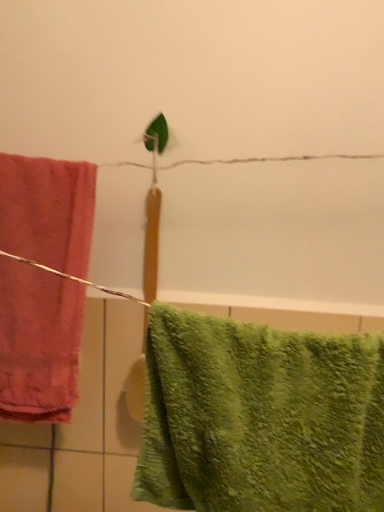
Question: Is green fuzzy towel at lower right, marked as the 2th towel in a left-to-right arrangement, further to the viewer compared to matte pink towel at left, arranged as the 2th towel when viewed from the right?

Choices:
 (A) no
 (B) yes

Answer: (A)

Question: Considering the relative sizes of green fuzzy towel at lower right, arranged as the first towel when viewed from the right, and matte pink towel at left, which is counted as the 2th towel, starting from the front, in the image provided, is green fuzzy towel at lower right, arranged as the first towel when viewed from the right, taller than matte pink towel at left, which is counted as the 2th towel, starting from the front,?

Choices:
 (A) yes
 (B) no

Answer: (B)

Question: Does green fuzzy towel at lower right, which ranks as the first towel in front-to-back order, have a lesser width compared to matte pink towel at left, arranged as the 2th towel when viewed from the right?

Choices:
 (A) yes
 (B) no

Answer: (B)

Question: Is green fuzzy towel at lower right, which ranks as the first towel in front-to-back order, closer to camera compared to matte pink towel at left, marked as the 1th towel in a left-to-right arrangement?

Choices:
 (A) yes
 (B) no

Answer: (A)

Question: Are green fuzzy towel at lower right, which ranks as the first towel in front-to-back order, and matte pink towel at left, which is counted as the 2th towel, starting from the front, located far from each other?

Choices:
 (A) yes
 (B) no

Answer: (B)

Question: Does green fuzzy towel at lower right, marked as the 2th towel in a left-to-right arrangement, have a greater width compared to matte pink towel at left, the 1th towel in the back-to-front sequence?

Choices:
 (A) yes
 (B) no

Answer: (A)

Question: From a real-world perspective, is matte pink towel at left, the 1th towel in the back-to-front sequence, on top of green fuzzy towel at lower right, arranged as the first towel when viewed from the right?

Choices:
 (A) yes
 (B) no

Answer: (A)

Question: Does matte pink towel at left, which is counted as the 2th towel, starting from the front, have a larger size compared to green fuzzy towel at lower right, placed as the 2th towel when sorted from back to front?

Choices:
 (A) yes
 (B) no

Answer: (B)

Question: Considering the relative positions of matte pink towel at left, which is counted as the 2th towel, starting from the front, and green fuzzy towel at lower right, marked as the 2th towel in a left-to-right arrangement, in the image provided, is matte pink towel at left, which is counted as the 2th towel, starting from the front, in front of green fuzzy towel at lower right, marked as the 2th towel in a left-to-right arrangement,?

Choices:
 (A) no
 (B) yes

Answer: (A)

Question: From the image's perspective, is matte pink towel at left, the 1th towel in the back-to-front sequence, over green fuzzy towel at lower right, arranged as the first towel when viewed from the right?

Choices:
 (A) yes
 (B) no

Answer: (A)

Question: Considering the relative sizes of matte pink towel at left, the 1th towel in the back-to-front sequence, and green fuzzy towel at lower right, arranged as the first towel when viewed from the right, in the image provided, is matte pink towel at left, the 1th towel in the back-to-front sequence, shorter than green fuzzy towel at lower right, arranged as the first towel when viewed from the right,?

Choices:
 (A) no
 (B) yes

Answer: (A)

Question: Is matte pink towel at left, arranged as the 2th towel when viewed from the right, in contact with green fuzzy towel at lower right, placed as the 2th towel when sorted from back to front?

Choices:
 (A) yes
 (B) no

Answer: (B)

Question: From the image's perspective, is matte pink towel at left, arranged as the 2th towel when viewed from the right, above or below green fuzzy towel at lower right, marked as the 2th towel in a left-to-right arrangement?

Choices:
 (A) below
 (B) above

Answer: (B)